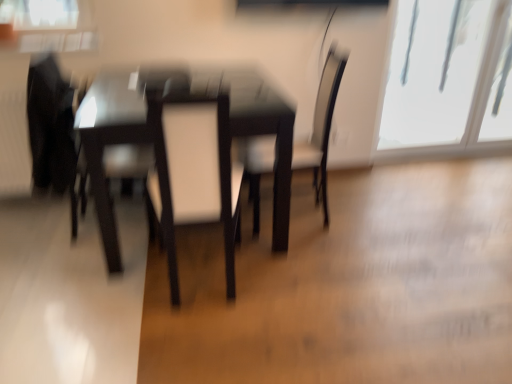
Question: Is white leather swivel chair at center, marked as the 2th swivel chair in a left-to-right arrangement, taller or shorter than matte black swivel chair at left, acting as the second swivel chair starting from the right?

Choices:
 (A) short
 (B) tall

Answer: (B)

Question: Relative to matte black swivel chair at left, acting as the second swivel chair starting from the right, is white leather swivel chair at center, arranged as the first swivel chair when viewed from the right, in front or behind?

Choices:
 (A) behind
 (B) front

Answer: (B)

Question: Which of these objects is positioned closest to the matte black chair at center?

Choices:
 (A) matte black swivel chair at left, which is the 1th swivel chair from left to right
 (B) white leather swivel chair at center, arranged as the first swivel chair when viewed from the right
 (C) glossy dark wood table at center
 (D) transparent glass window at upper right

Answer: (B)

Question: Which object is the farthest from the matte black chair at center?

Choices:
 (A) transparent glass window at upper right
 (B) white leather swivel chair at center, marked as the 2th swivel chair in a left-to-right arrangement
 (C) glossy dark wood table at center
 (D) matte black swivel chair at left, acting as the second swivel chair starting from the right

Answer: (A)